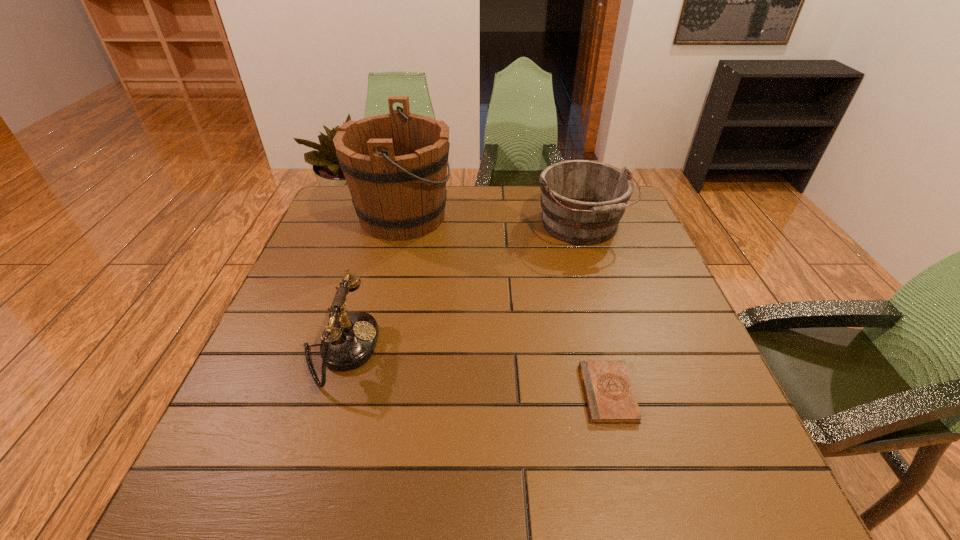
Image resolution: width=960 pixels, height=540 pixels. Identify the location of free location at the near right corner of the desktop. coord(716,470).

The width and height of the screenshot is (960, 540). Find the location of `blank region between the shorter wine bucket and the telephone`. blank region between the shorter wine bucket and the telephone is located at coordinates (461, 287).

Locate an element on the screen. free space between the right wine bucket and the tallest object is located at coordinates (492, 221).

Locate an element on the screen. empty space that is in between the telephone and the shortest object is located at coordinates click(x=474, y=371).

I want to click on free space between the shorter wine bucket and the taller wine bucket, so click(492, 221).

Where is `empty location between the shortest object and the tallest object`? empty location between the shortest object and the tallest object is located at coordinates pyautogui.click(x=505, y=305).

Where is `free space between the tallest object and the diary`? This screenshot has height=540, width=960. free space between the tallest object and the diary is located at coordinates (505, 305).

The image size is (960, 540). What are the coordinates of `vacant point located between the right wine bucket and the left wine bucket` in the screenshot? It's located at (492, 221).

You are a GUI agent. You are given a task and a screenshot of the screen. Output one action in this format:
    pyautogui.click(x=<x>, y=<y>)
    Task: Click on the unoccupied area between the shortest object and the telephone
    The width and height of the screenshot is (960, 540).
    Given the screenshot: What is the action you would take?
    pyautogui.click(x=474, y=371)

Where is `vacant area that lies between the right wine bucket and the telephone`? vacant area that lies between the right wine bucket and the telephone is located at coordinates (461, 287).